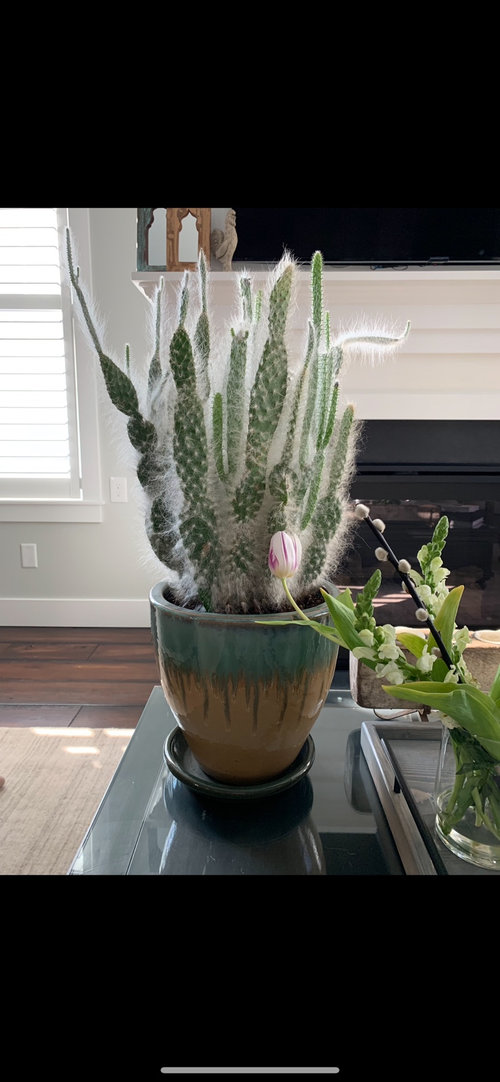
Identify the location of plate. The height and width of the screenshot is (1082, 500). (208, 791).